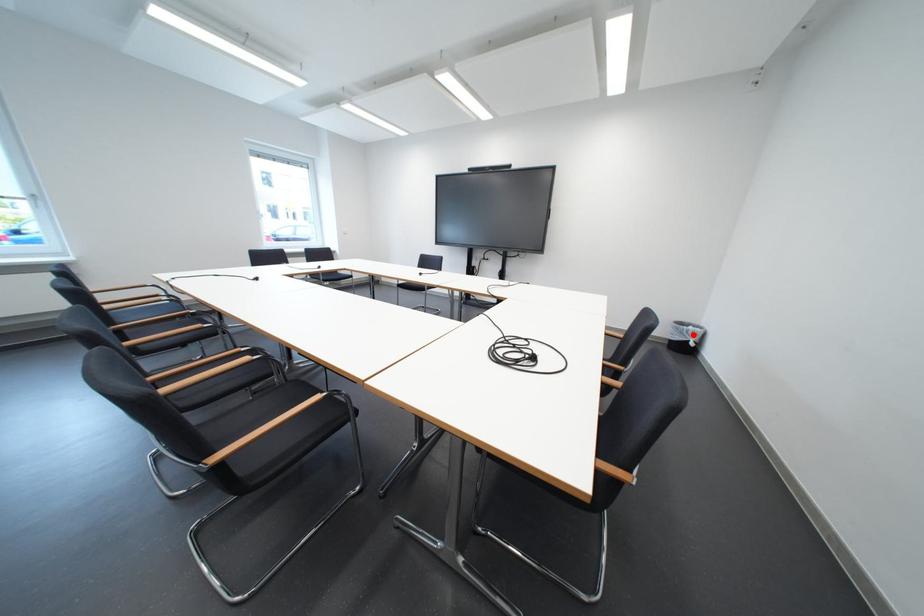
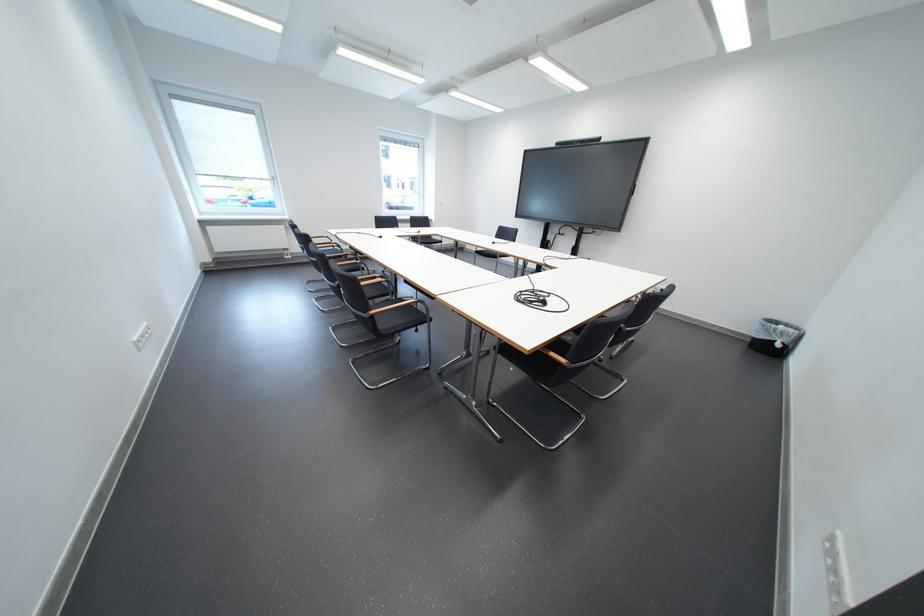
Question: I am providing you with two images of the same scene from different viewpoints. In image1, a red point is highlighted. Considering the same 3D point in image2, which of the following is correct?

Choices:
 (A) It is closer
 (B) It is farther

Answer: (A)